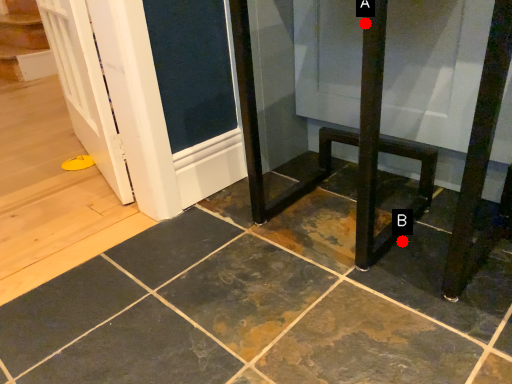
Question: Two points are circled on the image, labeled by A and B beside each circle. Which of the following is the farthest from the observer?

Choices:
 (A) A is further
 (B) B is further

Answer: (B)